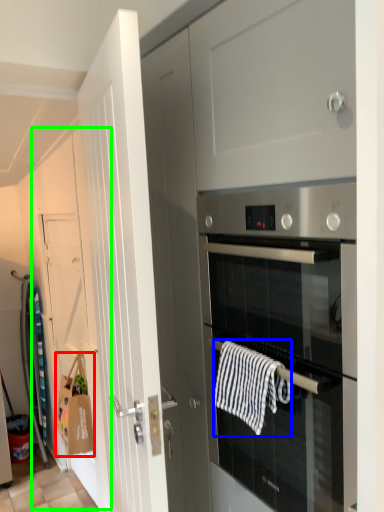
Question: Estimate the real-world distances between objects in this image. Which object is farther from hand towel (highlighted by a red box), hand towel (highlighted by a blue box) or door (highlighted by a green box)?

Choices:
 (A) hand towel
 (B) door

Answer: (A)